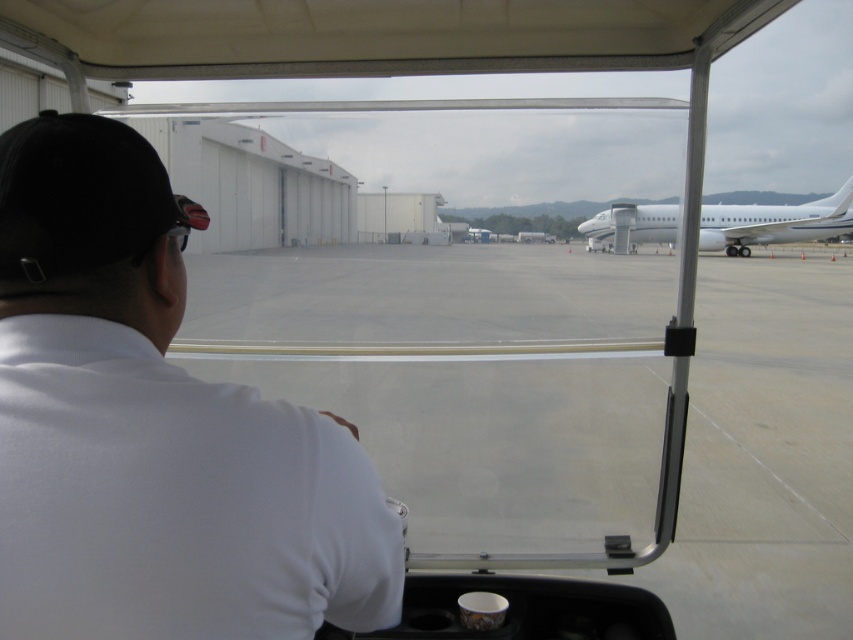
What do you see at coordinates (154, 428) in the screenshot? I see `white matte shirt at left` at bounding box center [154, 428].

Who is more forward, (x=212, y=513) or (x=674, y=234)?

Point (x=212, y=513) is in front.

The height and width of the screenshot is (640, 853). I want to click on white matte shirt at left, so click(154, 428).